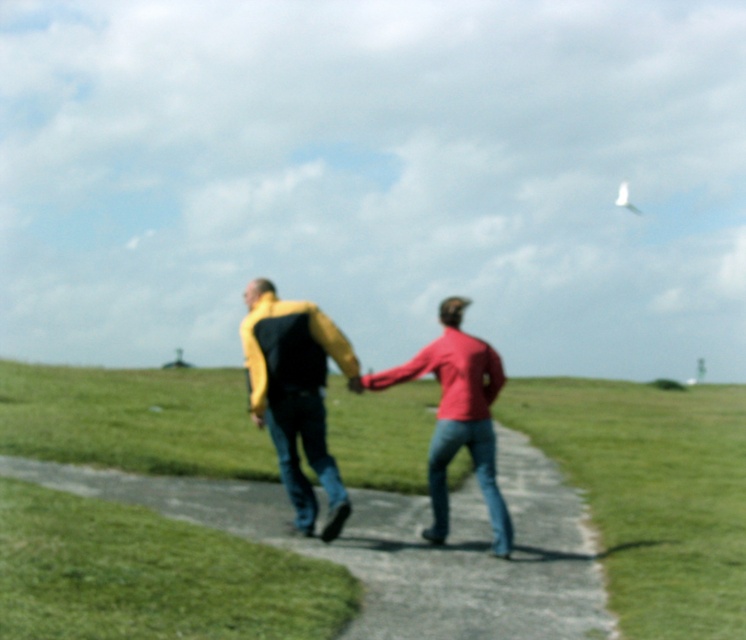
Does point (298, 371) come behind point (329, 481)?

Yes, point (298, 371) is behind point (329, 481).

What do you see at coordinates (295, 390) in the screenshot? The height and width of the screenshot is (640, 746). I see `yellow fabric jacket at center` at bounding box center [295, 390].

In order to click on yellow fabric jacket at center in this screenshot , I will do `click(295, 390)`.

Does green grass at center have a larger size compared to yellow matte jacket at center?

Correct, green grass at center is larger in size than yellow matte jacket at center.

Between green grass at center and yellow matte jacket at center, which one appears on the left side from the viewer's perspective?

green grass at center

Does point (557, 404) lie in front of point (295, 476)?

No.

What are the coordinates of `green grass at center` in the screenshot? It's located at (651, 492).

Locate an element on the screen. green grass at center is located at coordinates (651, 492).

Based on the photo, can you confirm if green grass at center is bigger than yellow fabric jacket at center?

Yes, green grass at center is bigger than yellow fabric jacket at center.

Find the location of `green grass at center`. green grass at center is located at coordinates (651, 492).